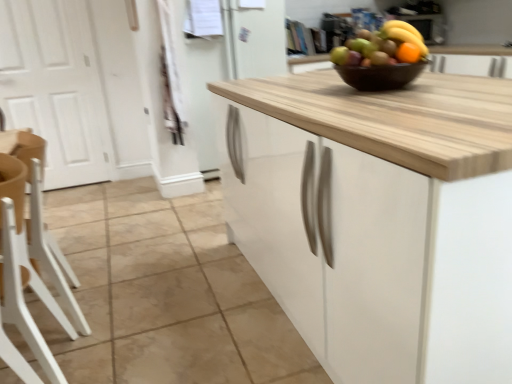
At what (x,y) coordinates should I click in order to perform the action: click on free spot behind white wood chair at left, the 1th chair viewed from the back. Please return your answer as a coordinate pair (x, y). The height and width of the screenshot is (384, 512). Looking at the image, I should click on (103, 274).